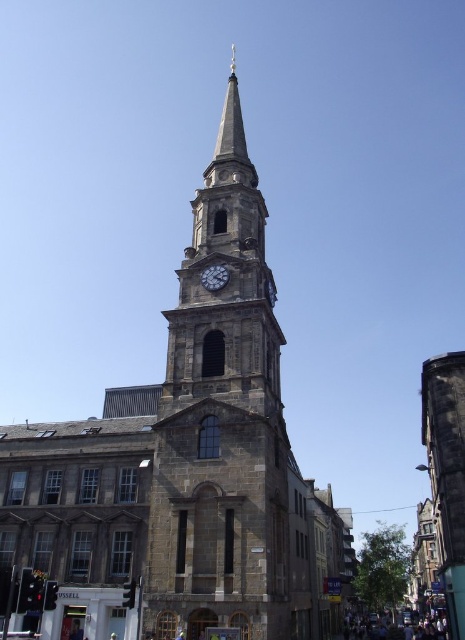
You are an architect evaluating the church layout. Which object, the stone clock tower at center or the dark gray stone clock at upper center, has a greater vertical height in the image?

The stone clock tower at center is taller than the dark gray stone clock at upper center.

You are an architect analyzing the spatial arrangement of the church and its clock. Based on the scene, can you determine which object is closer to the observer between the gray stone church steeple at center and the dark gray stone clock at upper center?

The gray stone church steeple at center is in front of the dark gray stone clock at upper center, so it is closer to the observer.

You are an architect analyzing the church layout. Which object, the stone clock tower at center or the dark gray stone clock at upper center, occupies more space in the image?

The stone clock tower at center has a larger size compared to the dark gray stone clock at upper center, so it occupies more space in the image.